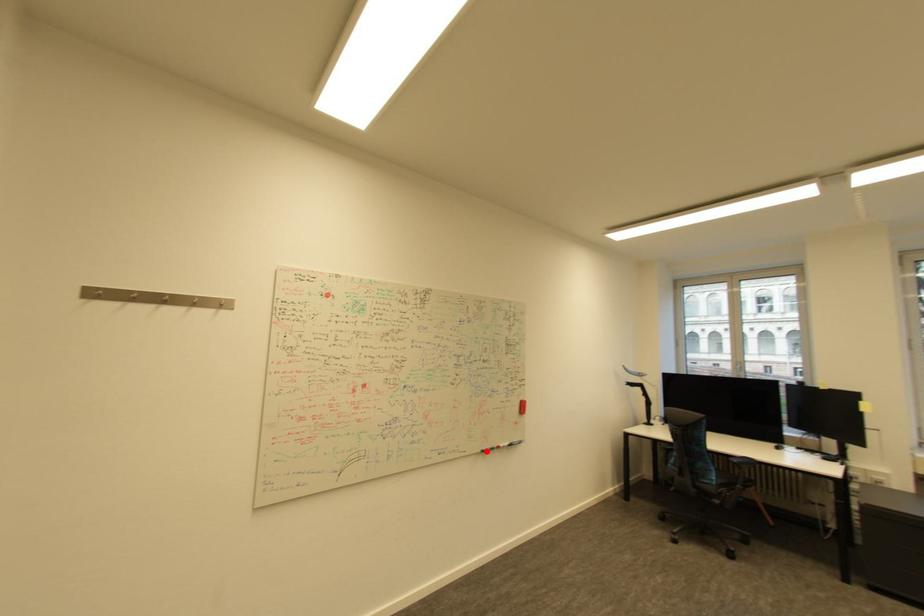
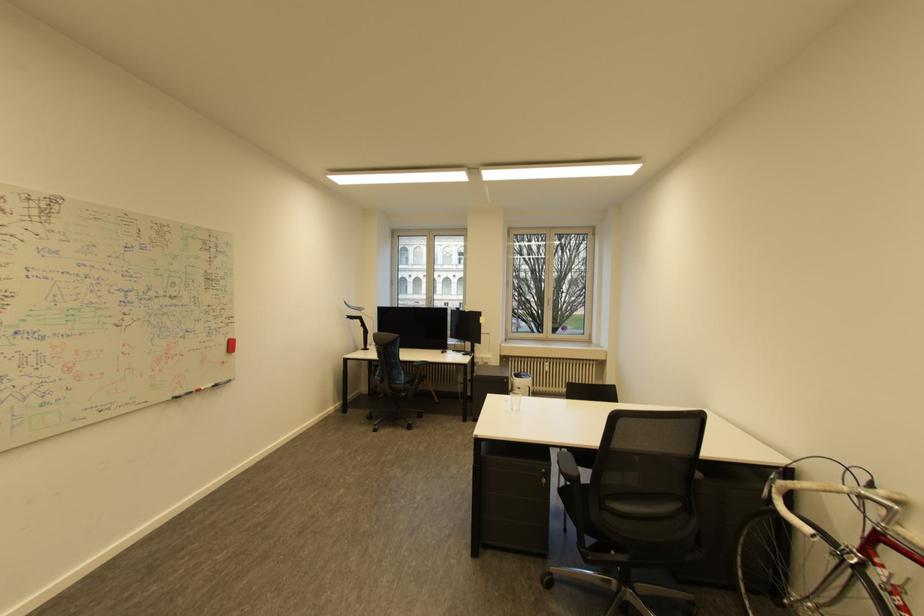
Find the pixel in the second image that matches the highlighted location in the first image.

(176, 399)